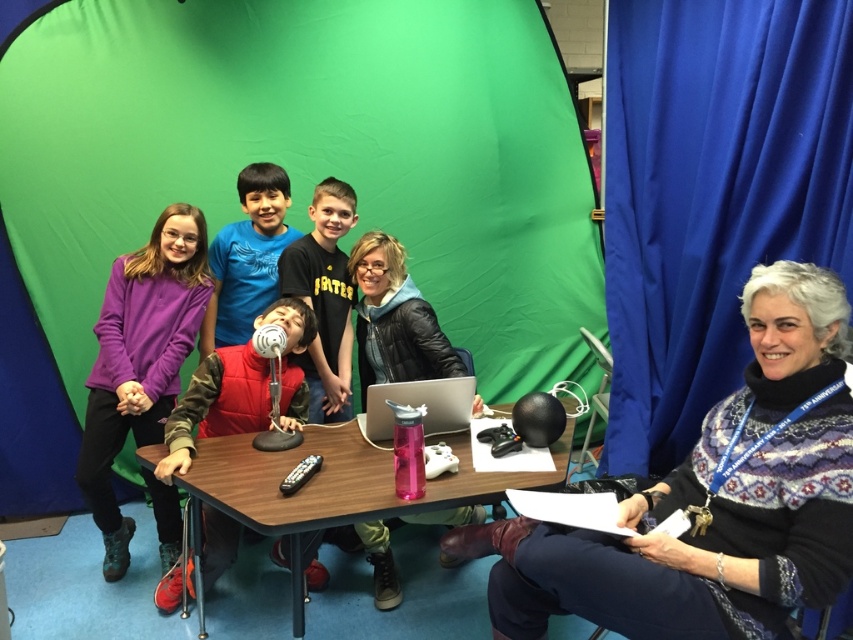
You are setting up a photo shoot in a studio with a green screen backdrop. You have a green fabric tent at center and a velvet red vest at center. Where should you place the green fabric tent relative to the velvet red vest to match the scene?

The green fabric tent at center should be placed on the left side of the velvet red vest at center to match the scene.

You are a costume designer working on a video project. You need to place a red scarf exactly at the position of the white wool sweater at right. What coordinates should you use for the red scarf?

The red scarf should be placed at coordinates (712, 499), as that is the position of the white wool sweater at right.